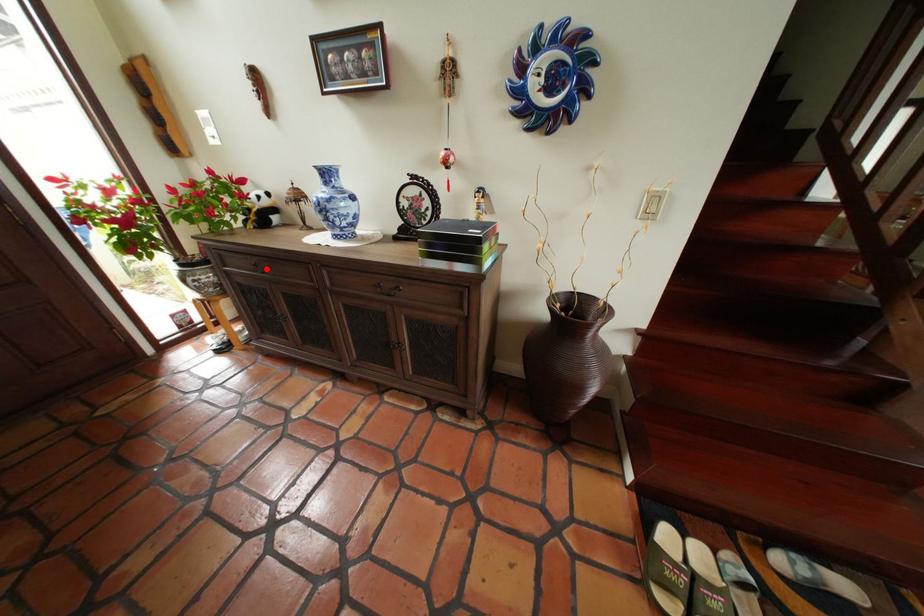
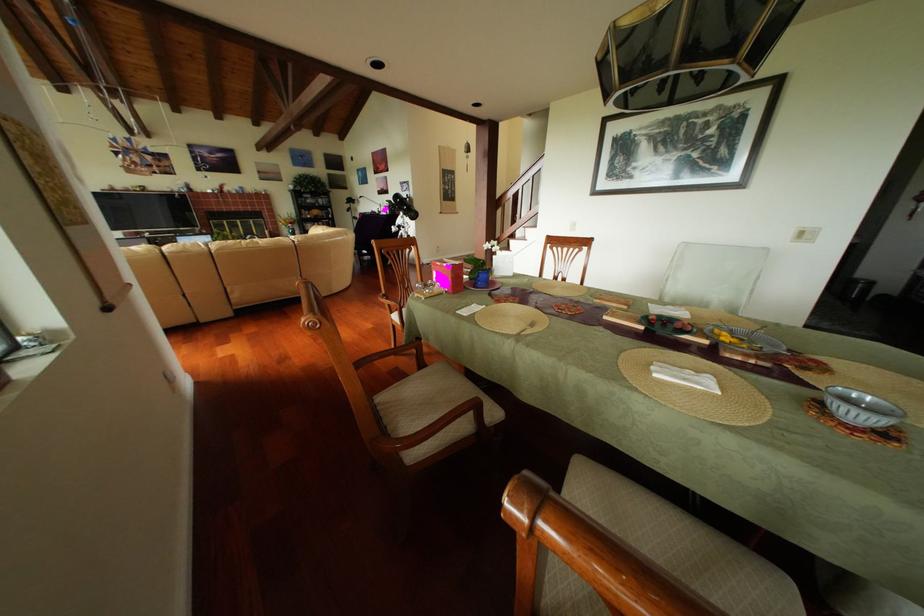
Question: I am providing you with two images of the same scene from different viewpoints. A red point is marked on the first image. Can you still see the location of the red point in image 2?

Choices:
 (A) Yes
 (B) No

Answer: (B)